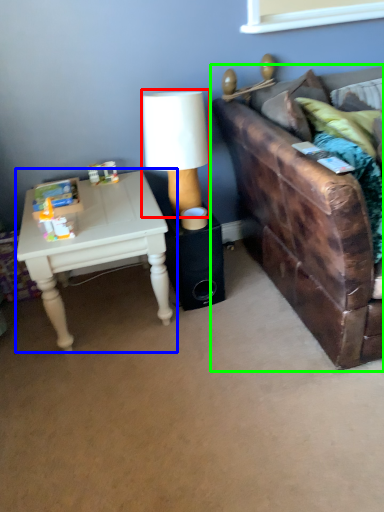
Question: Which is nearer to the table lamp (highlighted by a red box)? table (highlighted by a blue box) or studio couch (highlighted by a green box).

Choices:
 (A) table
 (B) studio couch

Answer: (A)